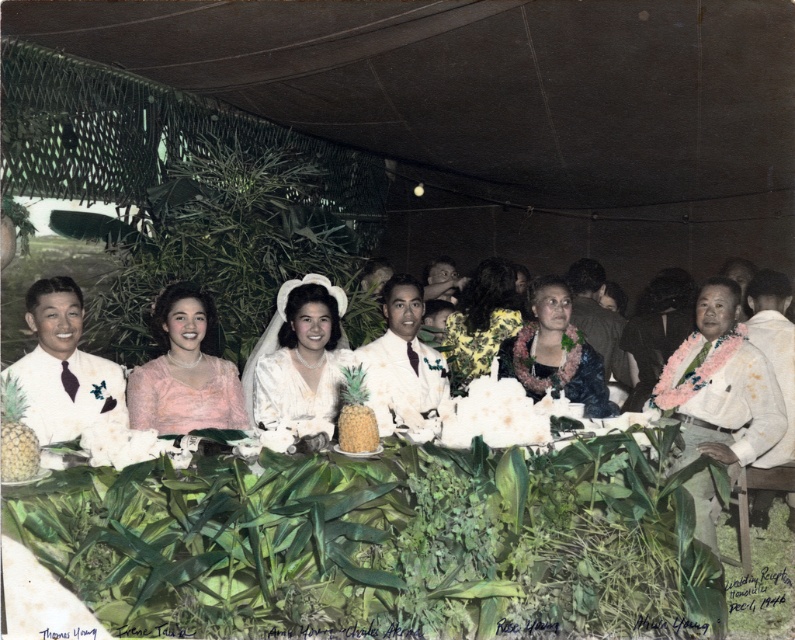
You are a photographer standing at the center of the wedding reception. You want to take a photo that includes both the point at coordinates point (499, 316) and point (342, 448). Given their positions, which point should be placed closer to the front of the photo to ensure both are in focus?

Point (342, 448) should be placed closer to the front of the photo because it is in front of point (499, 316), so positioning it towards the front will help keep both in focus.